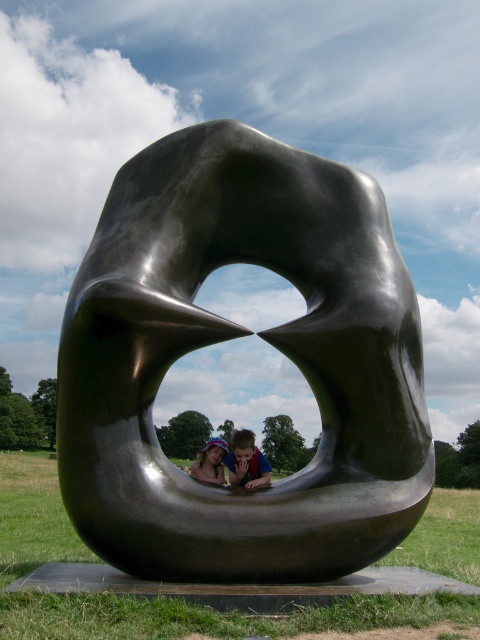
Question: Which of these objects is positioned closest to the shiny dark green sculpture at center?

Choices:
 (A) matte blue hat at center
 (B) blue fabric face at center

Answer: (B)

Question: Does blue fabric face at center have a smaller size compared to matte blue hat at center?

Choices:
 (A) yes
 (B) no

Answer: (B)

Question: Where is shiny dark green sculpture at center located in relation to matte blue hat at center in the image?

Choices:
 (A) right
 (B) left

Answer: (A)

Question: Which object is closer to the camera taking this photo?

Choices:
 (A) shiny dark green sculpture at center
 (B) matte blue hat at center

Answer: (A)

Question: Which point appears closest to the camera in this image?

Choices:
 (A) (228, 451)
 (B) (263, 477)

Answer: (B)

Question: Where is shiny dark green sculpture at center located in relation to matte blue hat at center in the image?

Choices:
 (A) below
 (B) above

Answer: (B)